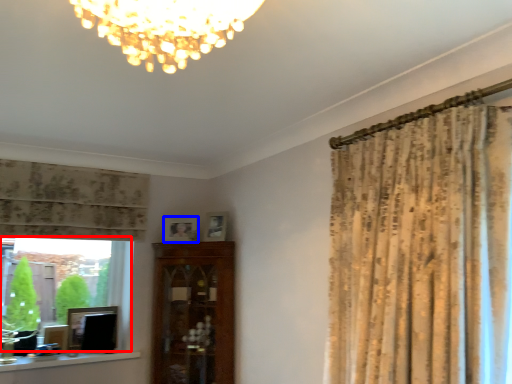
Question: Which object is further to the camera taking this photo, bay window (highlighted by a red box) or picture frame (highlighted by a blue box)?

Choices:
 (A) bay window
 (B) picture frame

Answer: (B)